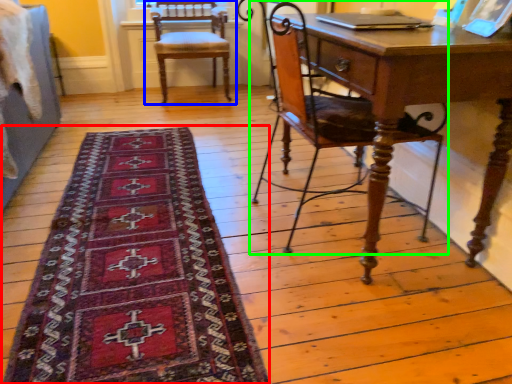
Question: Which object is positioned farthest from mat (highlighted by a red box)? Select from chair (highlighted by a blue box) and chair (highlighted by a green box).

Choices:
 (A) chair
 (B) chair

Answer: (A)